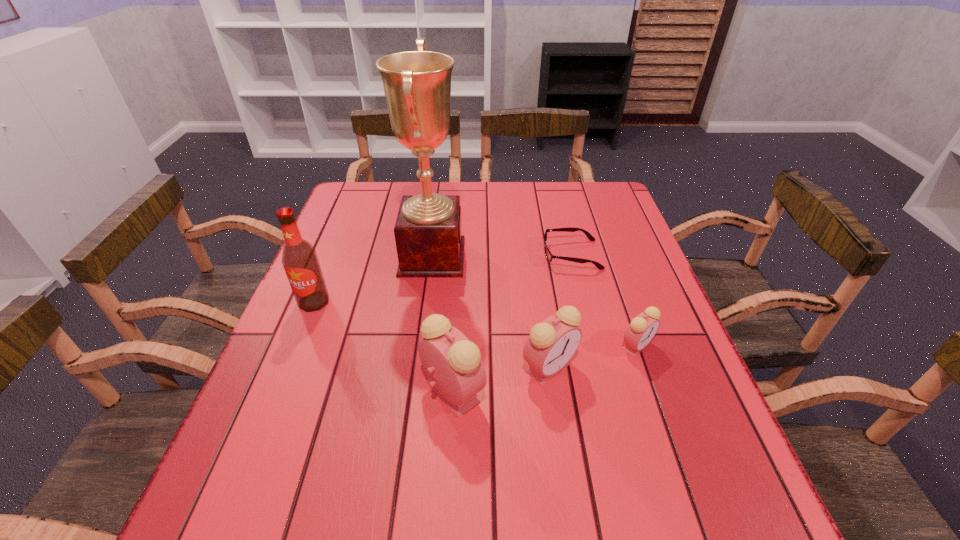
You are a GUI agent. You are given a task and a screenshot of the screen. Output one action in this format:
    pyautogui.click(x=<x>, y=<y>)
    Task: Click on the free space located 0.080m on the face of the second alarm clock from right to left
    
    Given the screenshot: What is the action you would take?
    pyautogui.click(x=558, y=427)

Image resolution: width=960 pixels, height=540 pixels. I want to click on vacant space situated on the face of the shortest alarm clock, so click(x=661, y=418).

Locate an element on the screen. The width and height of the screenshot is (960, 540). free region located on the right of the beer bottle is located at coordinates (456, 302).

You are a GUI agent. You are given a task and a screenshot of the screen. Output one action in this format:
    pyautogui.click(x=<x>, y=<y>)
    Task: Click on the free location located 0.290m on the plaque of the tallest object
    
    Given the screenshot: What is the action you would take?
    (x=569, y=257)

The width and height of the screenshot is (960, 540). What are the coordinates of `free space located 0.180m on the front-facing side of the spectacles` in the screenshot? It's located at (478, 255).

Where is `free space located 0.120m on the front-facing side of the spectacles`? Image resolution: width=960 pixels, height=540 pixels. free space located 0.120m on the front-facing side of the spectacles is located at coordinates tap(499, 255).

You are a GUI agent. You are given a task and a screenshot of the screen. Output one action in this format:
    pyautogui.click(x=<x>, y=<y>)
    Task: Click on the free spot located on the front-facing side of the spectacles
    This screenshot has height=540, width=960.
    Given the screenshot: What is the action you would take?
    pyautogui.click(x=445, y=255)

Locate an element on the screen. This screenshot has width=960, height=540. object that is at the left edge is located at coordinates click(x=299, y=258).

What are the coordinates of `alarm clock that is at the right edge` in the screenshot? It's located at (643, 327).

Find the location of a particular element. The width and height of the screenshot is (960, 540). spectacles that is at the right edge is located at coordinates (549, 256).